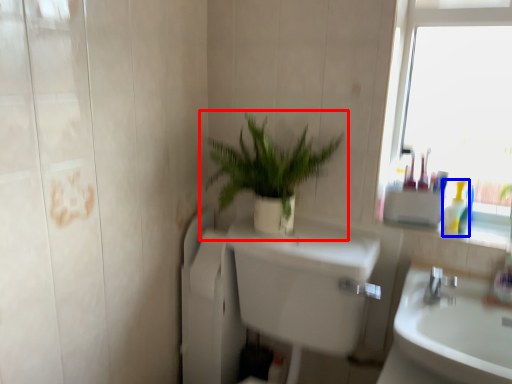
Question: Among these objects, which one is nearest to the camera, houseplant (highlighted by a red box) or toiletry (highlighted by a blue box)?

Choices:
 (A) houseplant
 (B) toiletry

Answer: (A)